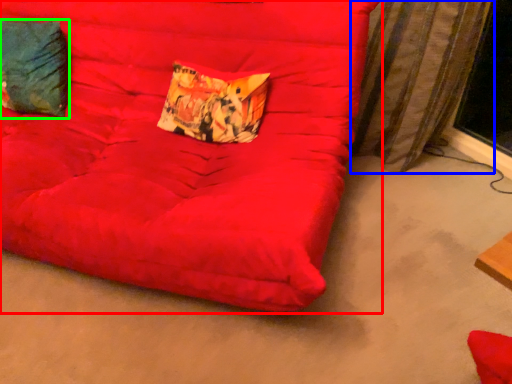
Question: Which is nearer to the furniture (highlighted by a red box)? curtain (highlighted by a blue box) or pillow (highlighted by a green box).

Choices:
 (A) curtain
 (B) pillow

Answer: (B)